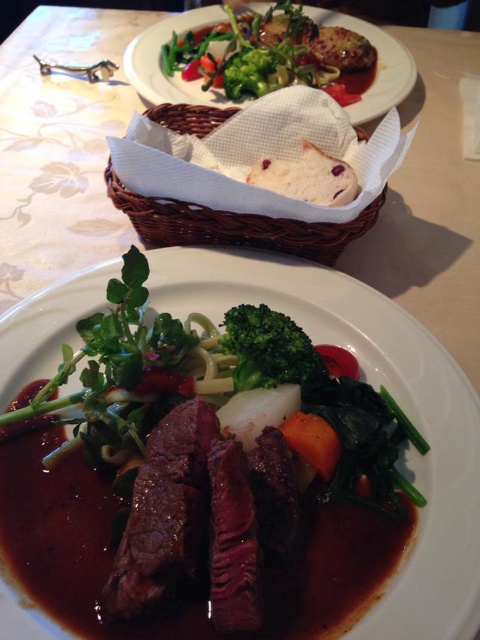
Who is taller, dark brown seared steak at center or green matte broccoli at center?

Standing taller between the two is dark brown seared steak at center.

Is point (193, 552) farther from viewer compared to point (273, 312)?

No, it is not.

Is point (216, 419) farther from viewer compared to point (256, 374)?

That is False.

Find the location of a particular element. dark brown seared steak at center is located at coordinates (164, 515).

Is point (74, 637) in front of point (100, 323)?

Yes, it is.

Describe the element at coordinates (374, 387) in the screenshot. I see `savory brown steak at center` at that location.

Who is more forward, (317, 296) or (92, 364)?

Point (92, 364)

Where is `savory brown steak at center`? This screenshot has width=480, height=640. savory brown steak at center is located at coordinates (374, 387).

Between point (166, 538) and point (330, 445), which one is positioned behind?

The point (330, 445) is more distant.

Is point (149, 509) positioned in front of point (325, 468)?

Yes, it is.

What are the coordinates of `dark brown seared steak at center` in the screenshot? It's located at (164, 515).

The height and width of the screenshot is (640, 480). I want to click on dark brown seared steak at center, so click(164, 515).